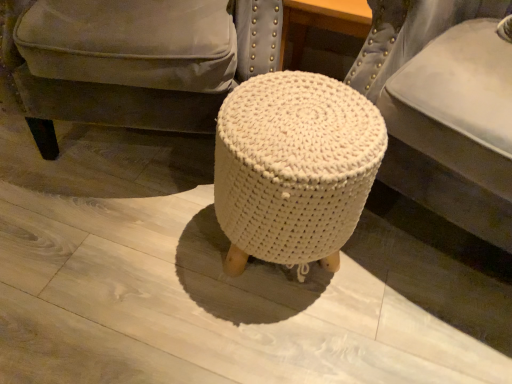
Question: Is white knitted stool at center far away from white knitted stool at center?

Choices:
 (A) no
 (B) yes

Answer: (A)

Question: Is white knitted stool at center outside of white knitted stool at center?

Choices:
 (A) no
 (B) yes

Answer: (B)

Question: Does white knitted stool at center come in front of white knitted stool at center?

Choices:
 (A) yes
 (B) no

Answer: (A)

Question: Is white knitted stool at center looking in the opposite direction of white knitted stool at center?

Choices:
 (A) yes
 (B) no

Answer: (A)

Question: Can you confirm if white knitted stool at center is thinner than white knitted stool at center?

Choices:
 (A) no
 (B) yes

Answer: (B)

Question: Considering the relative positions of white knitted stool at center and white knitted stool at center in the image provided, is white knitted stool at center to the left or to the right of white knitted stool at center?

Choices:
 (A) left
 (B) right

Answer: (B)

Question: Is point (224, 110) closer or farther from the camera than point (204, 57)?

Choices:
 (A) closer
 (B) farther

Answer: (A)

Question: From the image's perspective, relative to white knitted stool at center, is white knitted stool at center above or below?

Choices:
 (A) below
 (B) above

Answer: (A)

Question: From a real-world perspective, is white knitted stool at center physically located above or below white knitted stool at center?

Choices:
 (A) below
 (B) above

Answer: (A)

Question: Considering the positions of white knitted stool at center and white knitted pouf at center in the image, is white knitted stool at center bigger or smaller than white knitted pouf at center?

Choices:
 (A) small
 (B) big

Answer: (A)

Question: In the image, is white knitted stool at center on the left side or the right side of white knitted pouf at center?

Choices:
 (A) left
 (B) right

Answer: (A)

Question: Is point (261, 203) closer or farther from the camera than point (374, 49)?

Choices:
 (A) farther
 (B) closer

Answer: (B)

Question: From the image's perspective, is white knitted stool at center above or below white knitted pouf at center?

Choices:
 (A) below
 (B) above

Answer: (A)

Question: Relative to white knitted stool at center, is white knitted pouf at center in front or behind?

Choices:
 (A) front
 (B) behind

Answer: (A)

Question: From the image's perspective, is white knitted pouf at center positioned above or below white knitted stool at center?

Choices:
 (A) above
 (B) below

Answer: (A)